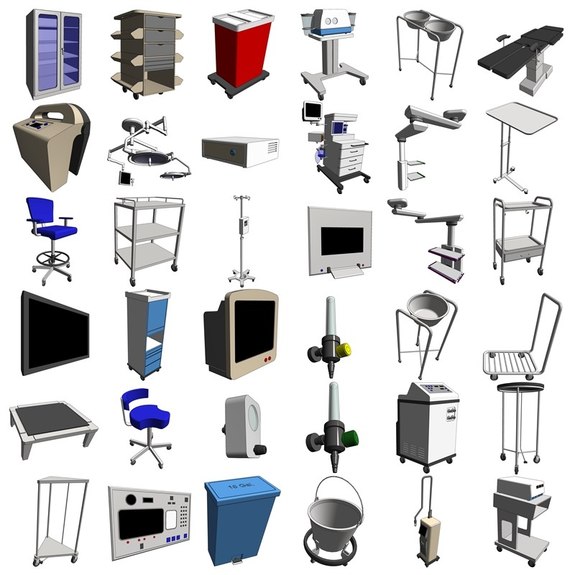
Where is `objects with shelves`? The image size is (575, 575). objects with shelves is located at coordinates (159, 240), (147, 72), (69, 55), (53, 538), (532, 548), (531, 248), (154, 347).